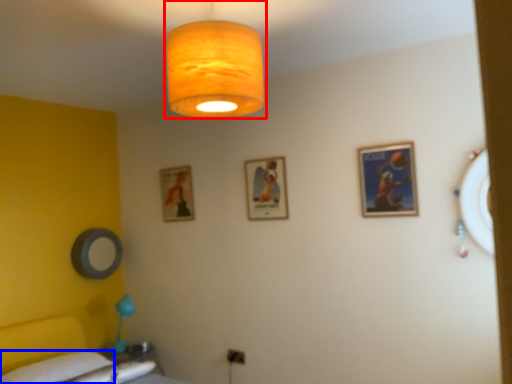
Question: Among these objects, which one is nearest to the camera, lamp (highlighted by a red box) or sheet (highlighted by a blue box)?

Choices:
 (A) lamp
 (B) sheet

Answer: (A)